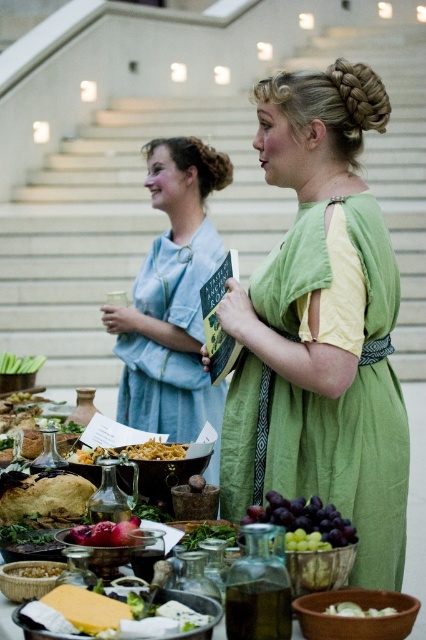
You are attending a historical reenactment event and notice the green velvet dress at center. Can you determine its exact location in the scene using the coordinate system provided?

The green velvet dress at center is located at point (321, 326) according to the coordinate system provided.

You are a guest at this historical event and want to compliment the host on their outfit and the food presentation. Which object is positioned to the right of the other between the green velvet dress at center and the matte glass bowl at center?

The green velvet dress at center is positioned to the right of the matte glass bowl at center.